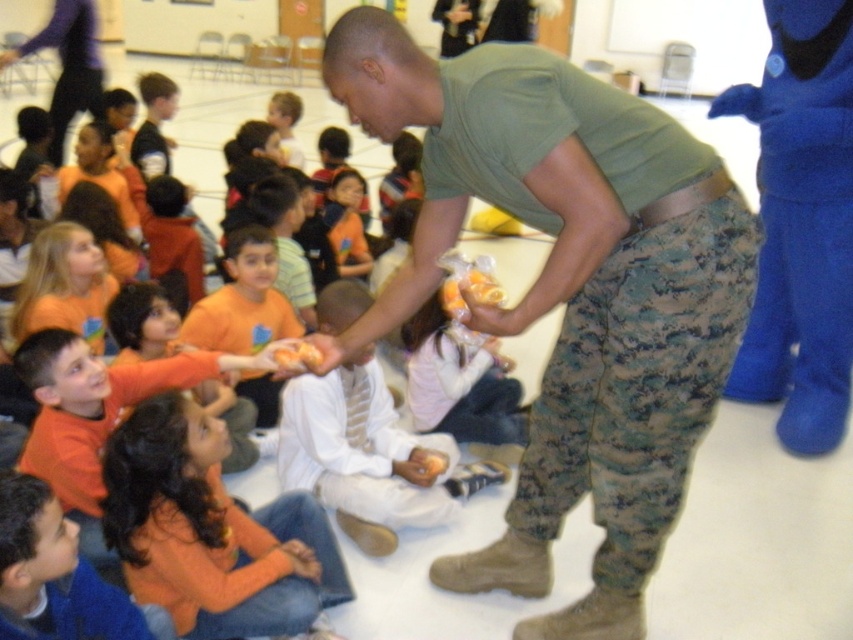
Question: Which of the following is the farthest from the observer?

Choices:
 (A) (73, 20)
 (B) (814, 122)
 (C) (289, 365)
 (D) (85, 196)

Answer: (A)

Question: Does green camouflage pants at center have a greater width compared to camouflage pants at center?

Choices:
 (A) yes
 (B) no

Answer: (A)

Question: Is orange cotton shirt at center to the left of orange shirt at upper left from the viewer's perspective?

Choices:
 (A) no
 (B) yes

Answer: (A)

Question: Is orange cotton shirt at lower left to the left of orange shirt at center from the viewer's perspective?

Choices:
 (A) yes
 (B) no

Answer: (A)

Question: Estimate the real-world distances between objects in this image. Which object is farther from the orange shirt at center?

Choices:
 (A) orange shirt at upper left
 (B) smooth orange shirt at lower left
 (C) green camouflage pants at center

Answer: (C)

Question: Estimate the real-world distances between objects in this image. Which object is closer to the orange shirt at center?

Choices:
 (A) green camouflage pants at center
 (B) camouflage pants at center

Answer: (B)